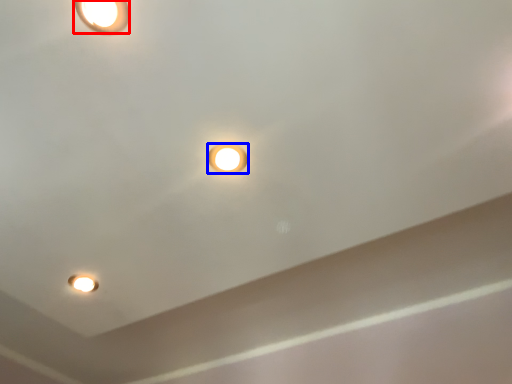
Question: Which point is closer to the camera, lamp (highlighted by a red box) or lamp (highlighted by a blue box)?

Choices:
 (A) lamp
 (B) lamp

Answer: (A)